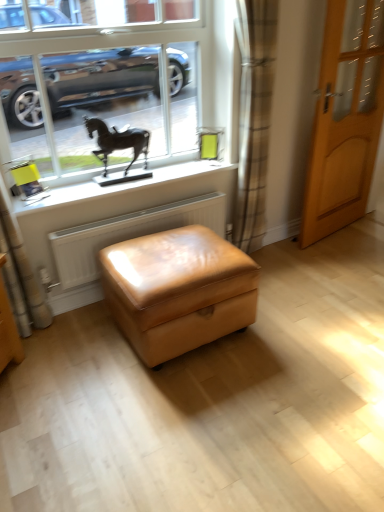
Locate an element on the screen. free location to the left of leather ottoman at center is located at coordinates (72, 360).